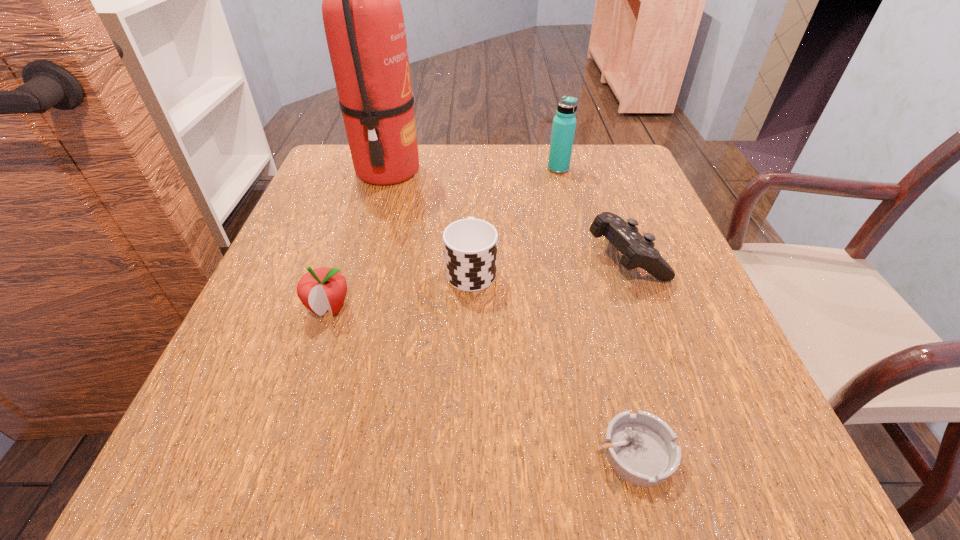
What are the coordinates of `control at the right edge` in the screenshot? It's located at point(638,251).

You are a GUI agent. You are given a task and a screenshot of the screen. Output one action in this format:
    pyautogui.click(x=<x>, y=<y>)
    Task: Click on the ashtray located at the right edge
    This screenshot has height=540, width=960.
    Given the screenshot: What is the action you would take?
    pyautogui.click(x=641, y=448)

At what (x,y) coordinates should I click in order to perform the action: click on object that is at the far left corner. Please return your answer as a coordinate pair (x, y). This screenshot has height=540, width=960. Looking at the image, I should click on (363, 19).

The width and height of the screenshot is (960, 540). In order to click on object positioned at the near right corner in this screenshot , I will do `click(641, 448)`.

The width and height of the screenshot is (960, 540). In order to click on blank space at the far edge of the desktop in this screenshot , I will do `click(540, 194)`.

In the image, there is a desktop. At what (x,y) coordinates should I click in order to perform the action: click on blank space at the near edge. Please return your answer as a coordinate pair (x, y). Looking at the image, I should click on (475, 489).

Find the location of `vacant space at the left edge of the desktop`. vacant space at the left edge of the desktop is located at coordinates (259, 305).

In the image, there is a desktop. Identify the location of free space at the right edge. This screenshot has width=960, height=540. (643, 214).

Locate an element on the screen. The width and height of the screenshot is (960, 540). free space at the far left corner of the desktop is located at coordinates (353, 174).

Identify the location of vacant space at the far right corner of the desktop. This screenshot has width=960, height=540. (644, 179).